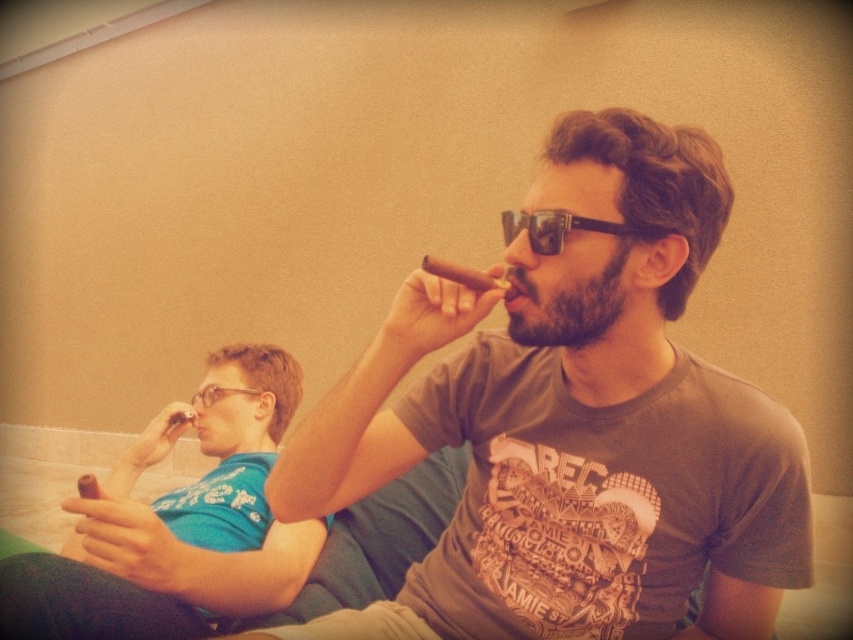
Locate an element on the screen. The width and height of the screenshot is (853, 640). matte brown cigar at center is located at coordinates (573, 432).

The image size is (853, 640). Find the location of `matte brown cigar at center`. matte brown cigar at center is located at coordinates coord(573,432).

Does point (567, 300) lie behind point (508, 285)?

Yes, it is.

Which is above, dark brown beard at center or beardsoft hairman smoking cigar at right?

beardsoft hairman smoking cigar at right is higher up.

Image resolution: width=853 pixels, height=640 pixels. Identify the location of dark brown beard at center. tap(570, 307).

Is black plastic sunglasses at center taller than beardsoft hairman smoking cigar at right?

Correct, black plastic sunglasses at center is much taller as beardsoft hairman smoking cigar at right.

Does black plastic sunglasses at center lie behind beardsoft hairman smoking cigar at right?

No, black plastic sunglasses at center is in front of beardsoft hairman smoking cigar at right.

Is point (598, 225) farther from viewer compared to point (515, 289)?

No, (598, 225) is closer to viewer.

Locate an element on the screen. The width and height of the screenshot is (853, 640). black plastic sunglasses at center is located at coordinates [x=569, y=228].